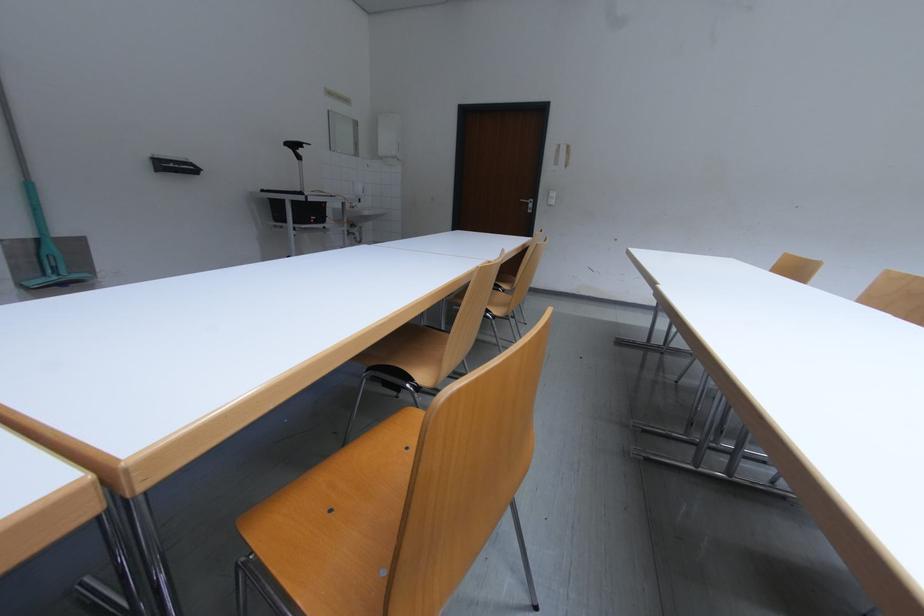
Find where to turn the silver door handle. Please return your answer as a coordinate pair (x, y).

(528, 204)